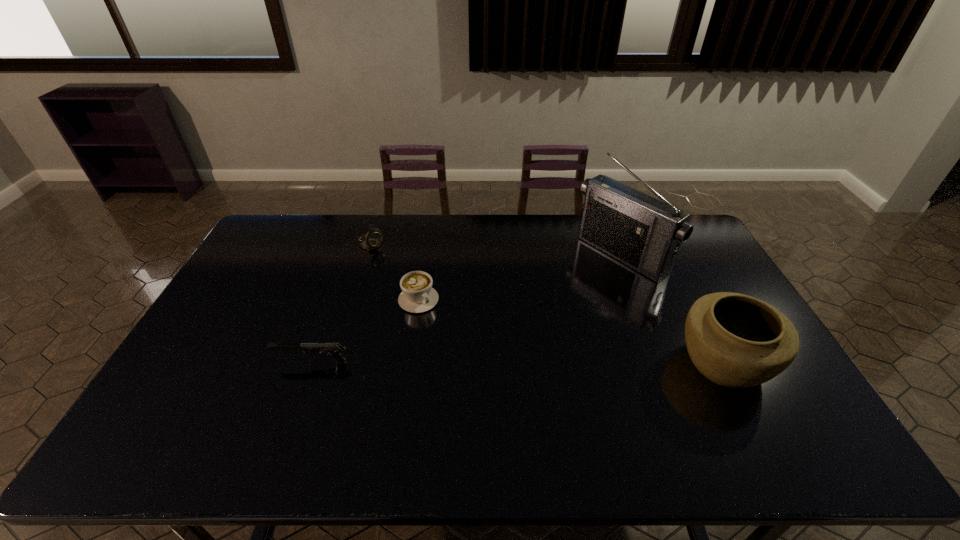
Find the location of a particular element. The image size is (960, 540). vacant region that satisfies the following two spatial constraints: 1. on the back side of the radio receiver; 2. on the right side of the third object from left to right is located at coordinates (425, 255).

Image resolution: width=960 pixels, height=540 pixels. I want to click on vacant position in the image that satisfies the following two spatial constraints: 1. on the front side of the radio receiver; 2. on the left side of the third shortest object, so click(368, 255).

Find the location of a particular element. vacant space that satisfies the following two spatial constraints: 1. on the front side of the cappuccino; 2. on the right side of the pottery is located at coordinates (409, 362).